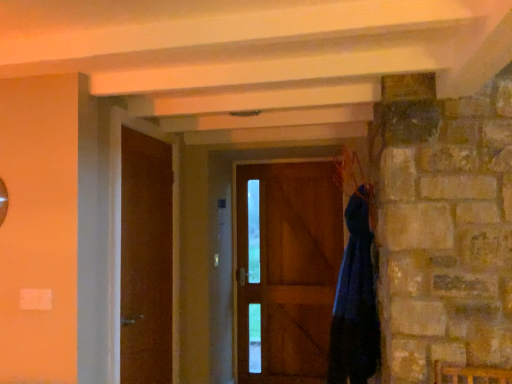
Question: Is wooden door at center, the second door viewed from the front, surrounding matte brown door at left, which ranks as the first door in left-to-right order?

Choices:
 (A) no
 (B) yes

Answer: (A)

Question: Considering the relative sizes of wooden door at center, acting as the first door starting from the back, and matte brown door at left, which ranks as the first door in left-to-right order, in the image provided, is wooden door at center, acting as the first door starting from the back, smaller than matte brown door at left, which ranks as the first door in left-to-right order,?

Choices:
 (A) yes
 (B) no

Answer: (A)

Question: Considering the relative sizes of wooden door at center, placed as the 1th door when sorted from right to left, and matte brown door at left, which ranks as the second door in back-to-front order, in the image provided, is wooden door at center, placed as the 1th door when sorted from right to left, thinner than matte brown door at left, which ranks as the second door in back-to-front order,?

Choices:
 (A) yes
 (B) no

Answer: (A)

Question: Is wooden door at center, placed as the 1th door when sorted from right to left, taller than matte brown door at left, the 1th door positioned from the front?

Choices:
 (A) yes
 (B) no

Answer: (A)

Question: From the image's perspective, is wooden door at center, placed as the 1th door when sorted from right to left, positioned above or below matte brown door at left, which ranks as the second door in back-to-front order?

Choices:
 (A) below
 (B) above

Answer: (A)

Question: Considering their positions, is wooden door at center, placed as the 1th door when sorted from right to left, located in front of or behind matte brown door at left, which ranks as the first door in left-to-right order?

Choices:
 (A) front
 (B) behind

Answer: (B)

Question: In the image, is wooden door at center, acting as the first door starting from the back, on the left side or the right side of matte brown door at left, which ranks as the second door in back-to-front order?

Choices:
 (A) left
 (B) right

Answer: (B)

Question: Considering the positions of point (292, 291) and point (135, 165), is point (292, 291) closer or farther from the camera than point (135, 165)?

Choices:
 (A) farther
 (B) closer

Answer: (A)

Question: Considering their positions, is wooden door at center, placed as the 1th door when sorted from right to left, located in front of or behind dark blue fabric at right?

Choices:
 (A) front
 (B) behind

Answer: (B)

Question: Looking at their shapes, would you say wooden door at center, which is counted as the second door, starting from the left, is wider or thinner than dark blue fabric at right?

Choices:
 (A) wide
 (B) thin

Answer: (B)

Question: In terms of height, does wooden door at center, acting as the first door starting from the back, look taller or shorter compared to dark blue fabric at right?

Choices:
 (A) short
 (B) tall

Answer: (B)

Question: Is wooden door at center, placed as the 1th door when sorted from right to left, bigger or smaller than dark blue fabric at right?

Choices:
 (A) big
 (B) small

Answer: (B)

Question: Is dark blue fabric at right spatially inside wooden door at center, placed as the 1th door when sorted from right to left, or outside of it?

Choices:
 (A) outside
 (B) inside

Answer: (A)

Question: From the image's perspective, is dark blue fabric at right located above or below wooden door at center, acting as the first door starting from the back?

Choices:
 (A) above
 (B) below

Answer: (A)